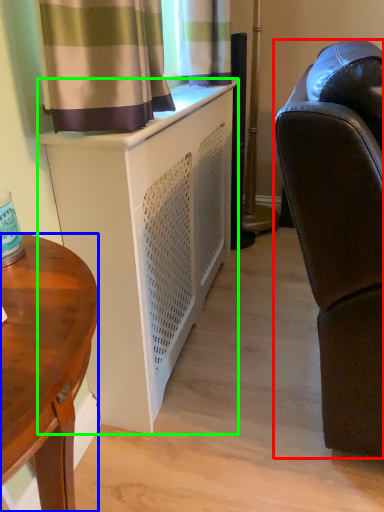
Question: Which object is the farthest from studio couch (highlighted by a red box)? Choose among these: desk (highlighted by a blue box) or cabinetry (highlighted by a green box).

Choices:
 (A) desk
 (B) cabinetry

Answer: (A)